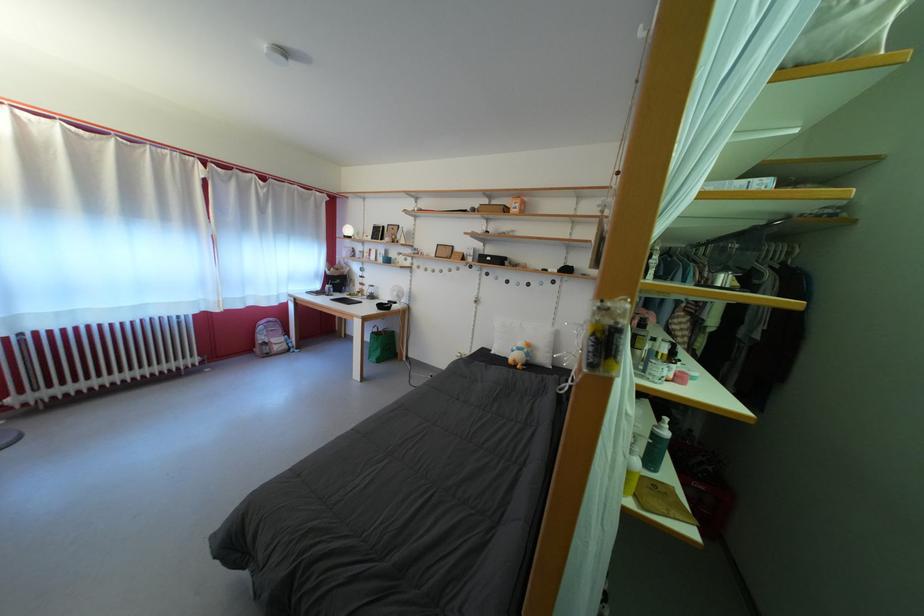
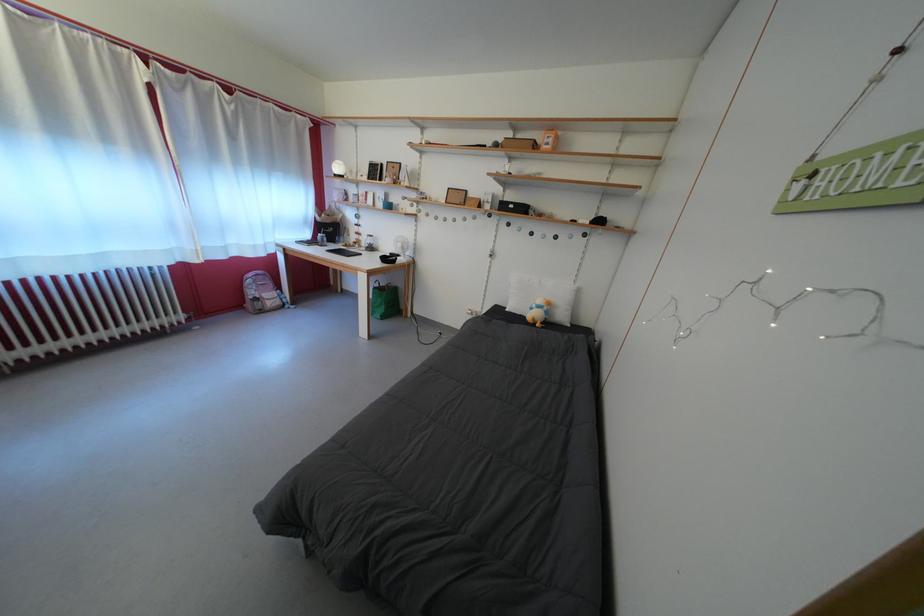
Find the pixel in the second image that matches (271,344) in the first image.

(261, 299)